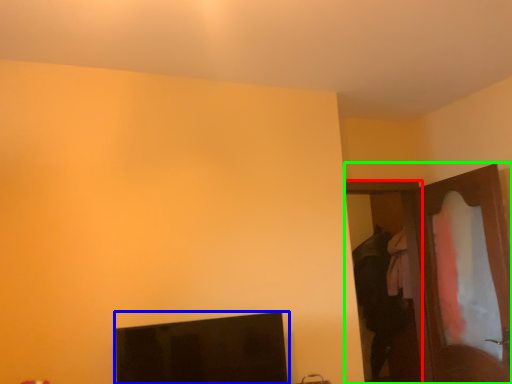
Question: Estimate the real-world distances between objects in this image. Which object is farther from door (highlighted by a red box), computer monitor (highlighted by a blue box) or dresser (highlighted by a green box)?

Choices:
 (A) computer monitor
 (B) dresser

Answer: (A)